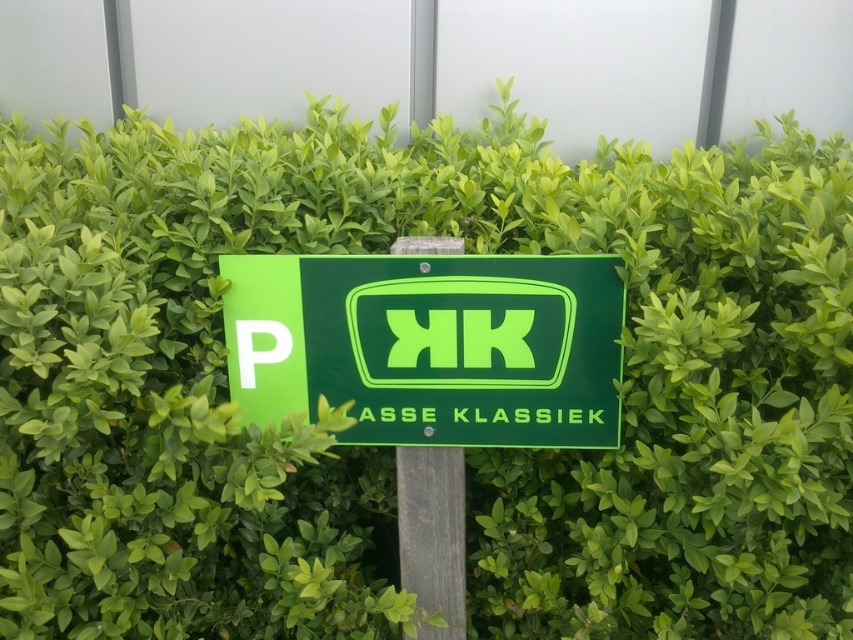
Is point (229, 372) positioned in front of point (451, 554)?

Yes.

Is neon green plastic sign at center behind wooden post at center?

That is False.

Is point (256, 337) less distant than point (422, 520)?

Yes, point (256, 337) is in front of point (422, 520).

Where is `neon green plastic sign at center`? This screenshot has height=640, width=853. neon green plastic sign at center is located at coordinates (430, 346).